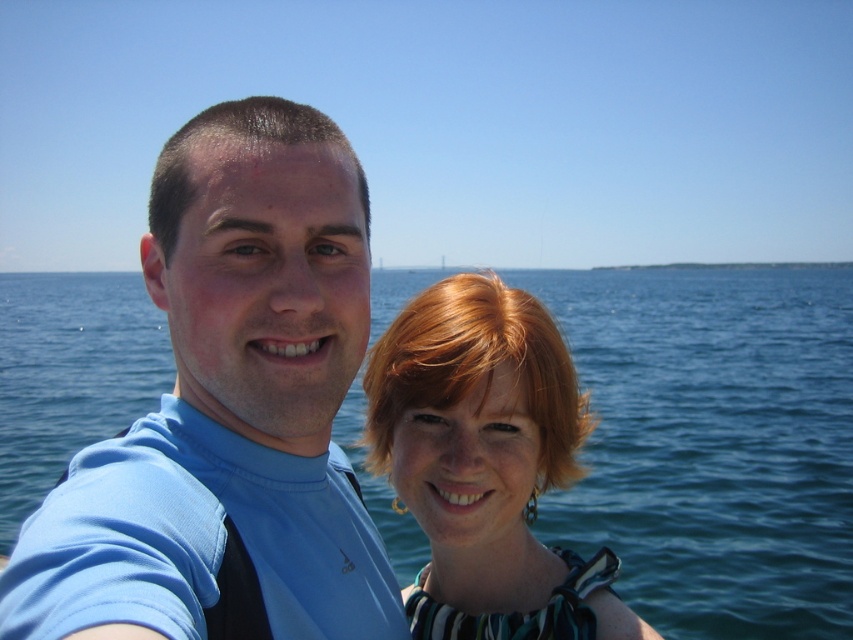
Which is below, blue water at center or shiny green dress at center?

shiny green dress at center is lower down.

Can you confirm if blue water at center is wider than shiny green dress at center?

Indeed, blue water at center has a greater width compared to shiny green dress at center.

Locate an element on the screen. The width and height of the screenshot is (853, 640). blue water at center is located at coordinates (712, 442).

Is point (200, 637) more distant than point (402, 371)?

No, (200, 637) is closer to viewer.

Where is `blue fabric shirt at center`? Image resolution: width=853 pixels, height=640 pixels. blue fabric shirt at center is located at coordinates (228, 406).

Does point (33, 524) come farther from viewer compared to point (381, 445)?

No, it is not.

Where is `blue fabric shirt at center`? The width and height of the screenshot is (853, 640). blue fabric shirt at center is located at coordinates (228, 406).

Based on the photo, can you confirm if blue water at center is positioned to the right of blue fabric shirt at center?

Correct, you'll find blue water at center to the right of blue fabric shirt at center.

Which is below, blue water at center or blue fabric shirt at center?

blue fabric shirt at center is below.

This screenshot has height=640, width=853. What are the coordinates of `blue water at center` in the screenshot? It's located at (712, 442).

Identify the location of blue water at center. (712, 442).